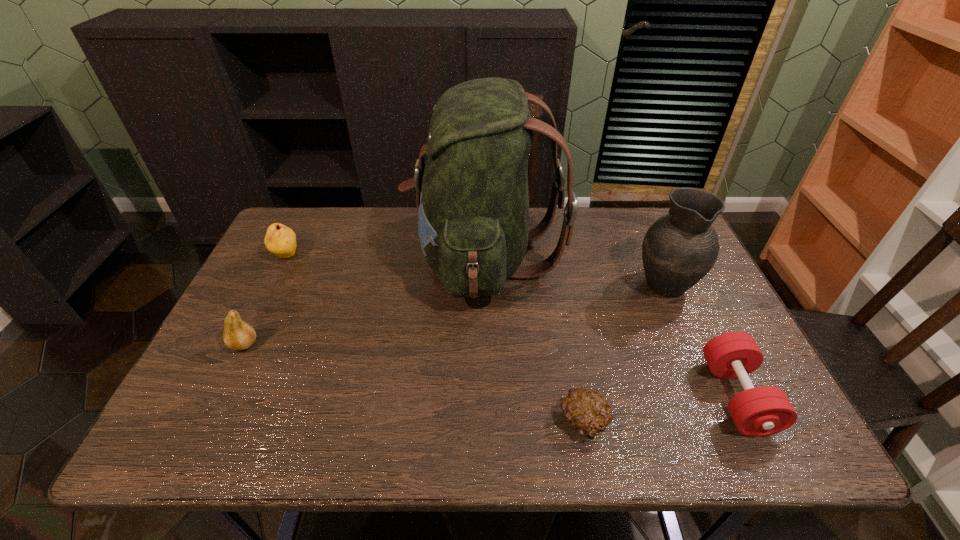
You are a GUI agent. You are given a task and a screenshot of the screen. Output one action in this format:
    pyautogui.click(x=<x>, y=<y>)
    Task: Click on the free spot located on the side of the pitcher with the handle
    The width and height of the screenshot is (960, 540).
    Given the screenshot: What is the action you would take?
    pyautogui.click(x=634, y=213)

Find the location of a particular element. The width and height of the screenshot is (960, 540). vacant area situated on the side of the pitcher with the handle is located at coordinates (635, 215).

At what (x,y) coordinates should I click in order to perform the action: click on blank area located 0.390m on the back of the fourth farthest object. Please return your answer as a coordinate pair (x, y). Looking at the image, I should click on (297, 238).

Locate an element on the screen. This screenshot has height=540, width=960. vacant space located on the right of the farther pear is located at coordinates (350, 256).

This screenshot has width=960, height=540. Find the location of `free location located on the back of the dumbbell`. free location located on the back of the dumbbell is located at coordinates (683, 286).

The height and width of the screenshot is (540, 960). In order to click on vacant area situated 0.380m on the left of the muffin in this screenshot , I will do pyautogui.click(x=379, y=422).

What are the coordinates of `backpack that is at the far edge` in the screenshot? It's located at (472, 195).

Where is `pear at the far edge`? pear at the far edge is located at coordinates (281, 240).

In order to click on dumbbell that is positioned at the near edge in this screenshot , I will do `click(761, 411)`.

I want to click on muffin located in the near edge section of the desktop, so click(x=587, y=411).